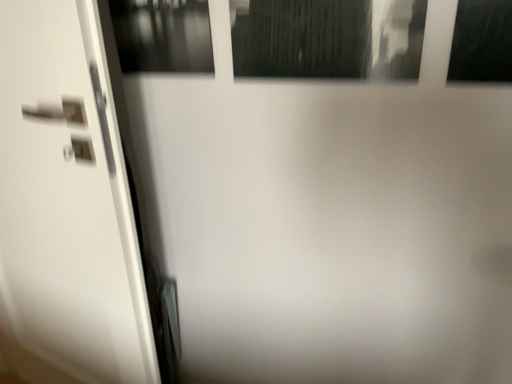
What is the approximate height of transparent glass window at upper left?

The height of transparent glass window at upper left is 12.30 inches.

You are a GUI agent. You are given a task and a screenshot of the screen. Output one action in this format:
    pyautogui.click(x=<x>, y=<y>)
    Task: Click on the transparent glass window at upper left
    The height and width of the screenshot is (384, 512).
    Given the screenshot: What is the action you would take?
    pyautogui.click(x=163, y=35)

The width and height of the screenshot is (512, 384). Describe the element at coordinates (163, 35) in the screenshot. I see `transparent glass window at upper left` at that location.

Describe the element at coordinates (67, 200) in the screenshot. I see `white glossy door handle at left` at that location.

I want to click on white glossy door handle at left, so click(67, 200).

Where is `transparent glass window at upper left`? The width and height of the screenshot is (512, 384). transparent glass window at upper left is located at coordinates (163, 35).

Which object is positioned more to the left, white glossy door handle at left or transparent glass window at upper left?

From the viewer's perspective, white glossy door handle at left appears more on the left side.

Which object is closer to the camera, white glossy door handle at left or transparent glass window at upper left?

white glossy door handle at left is in front.

Which is nearer, (81, 45) or (207, 41)?

Point (81, 45) appears to be closer to the viewer than point (207, 41).

From the image's perspective, who appears lower, white glossy door handle at left or transparent glass window at upper left?

From the image's view, white glossy door handle at left is below.

From a real-world perspective, between white glossy door handle at left and transparent glass window at upper left, who is vertically lower?

white glossy door handle at left, from a real-world perspective.

Is white glossy door handle at left thinner than transparent glass window at upper left?

No.

Which of these two, white glossy door handle at left or transparent glass window at upper left, stands shorter?

transparent glass window at upper left.

Can you confirm if white glossy door handle at left is bigger than transparent glass window at upper left?

Yes.

Is transparent glass window at upper left inside white glossy door handle at left?

No, transparent glass window at upper left is not surrounded by white glossy door handle at left.

Is white glossy door handle at left with transparent glass window at upper left?

No, white glossy door handle at left is not next to transparent glass window at upper left.

Could you tell me if white glossy door handle at left is turned towards transparent glass window at upper left?

No, white glossy door handle at left is not facing towards transparent glass window at upper left.

Locate an element on the screen. This screenshot has width=512, height=384. screen door beneath the transparent glass window at upper left (from a real-world perspective) is located at coordinates (67, 200).

Is transparent glass window at upper left at the left side of white glossy door handle at left?

No, transparent glass window at upper left is not to the left of white glossy door handle at left.

Is transparent glass window at upper left behind white glossy door handle at left?

Yes, transparent glass window at upper left is behind white glossy door handle at left.

Considering the positions of points (150, 48) and (59, 271), is point (150, 48) closer to camera compared to point (59, 271)?

Yes, it is in front of point (59, 271).

From the image's perspective, which object appears higher, transparent glass window at upper left or white glossy door handle at left?

transparent glass window at upper left is shown above in the image.

From a real-world perspective, which object stands above the other?

transparent glass window at upper left is physically above.

Can you confirm if transparent glass window at upper left is thinner than white glossy door handle at left?

Yes.

Is transparent glass window at upper left taller than white glossy door handle at left?

No.

Who is smaller, transparent glass window at upper left or white glossy door handle at left?

transparent glass window at upper left.

Is transparent glass window at upper left completely or partially outside of white glossy door handle at left?

Yes, transparent glass window at upper left is located beyond the bounds of white glossy door handle at left.

Is transparent glass window at upper left far away from white glossy door handle at left?

Actually, transparent glass window at upper left and white glossy door handle at left are a little close together.

Is transparent glass window at upper left positioned with its back to white glossy door handle at left?

No, transparent glass window at upper left's orientation is not away from white glossy door handle at left.

How many degrees apart are the facing directions of transparent glass window at upper left and white glossy door handle at left?

The facing directions of transparent glass window at upper left and white glossy door handle at left are 10.5 degrees apart.

At what (x,y) coordinates should I click in order to perform the action: click on window lying on the right of white glossy door handle at left. Please return your answer as a coordinate pair (x, y). The width and height of the screenshot is (512, 384). Looking at the image, I should click on (163, 35).

At what (x,y) coordinates should I click in order to perform the action: click on window on the right of white glossy door handle at left. Please return your answer as a coordinate pair (x, y). Looking at the image, I should click on (163, 35).

I want to click on screen door that appears on the left of transparent glass window at upper left, so click(67, 200).